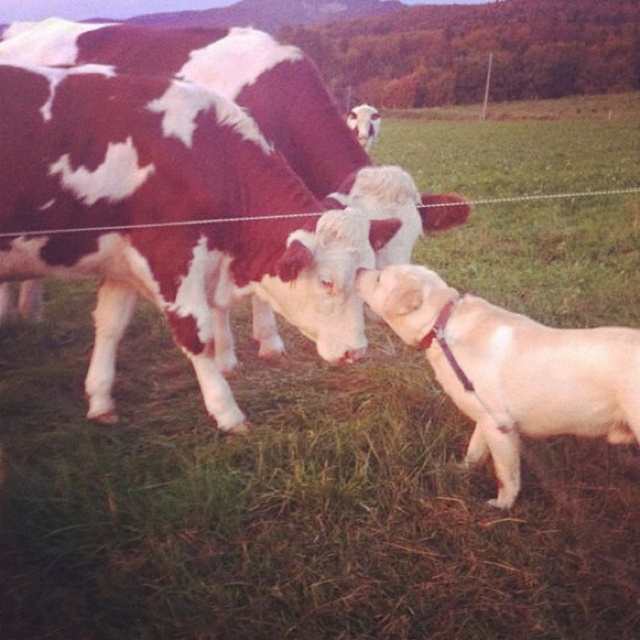
The width and height of the screenshot is (640, 640). I want to click on light brown fur at right, so pos(513,369).

From the picture: Does light brown fur at right appear under white fur dog at center?

Indeed, light brown fur at right is positioned under white fur dog at center.

The width and height of the screenshot is (640, 640). I want to click on light brown fur at right, so click(513, 369).

Who is shorter, smooth white dog at center or light brown fur at right?

With less height is light brown fur at right.

Can you confirm if smooth white dog at center is thinner than light brown fur at right?

In fact, smooth white dog at center might be wider than light brown fur at right.

Is point (88, 76) behind point (476, 412)?

Yes, point (88, 76) is behind point (476, 412).

The height and width of the screenshot is (640, 640). Identify the location of smooth white dog at center. (170, 218).

Measure the distance between smooth white dog at center and white fur dog at center.

smooth white dog at center and white fur dog at center are 1.50 meters apart.

Who is more forward, (268, 241) or (368, 140)?

Point (268, 241) is more forward.

At what (x,y) coordinates should I click in order to perform the action: click on smooth white dog at center. Please return your answer as a coordinate pair (x, y). Looking at the image, I should click on (170, 218).